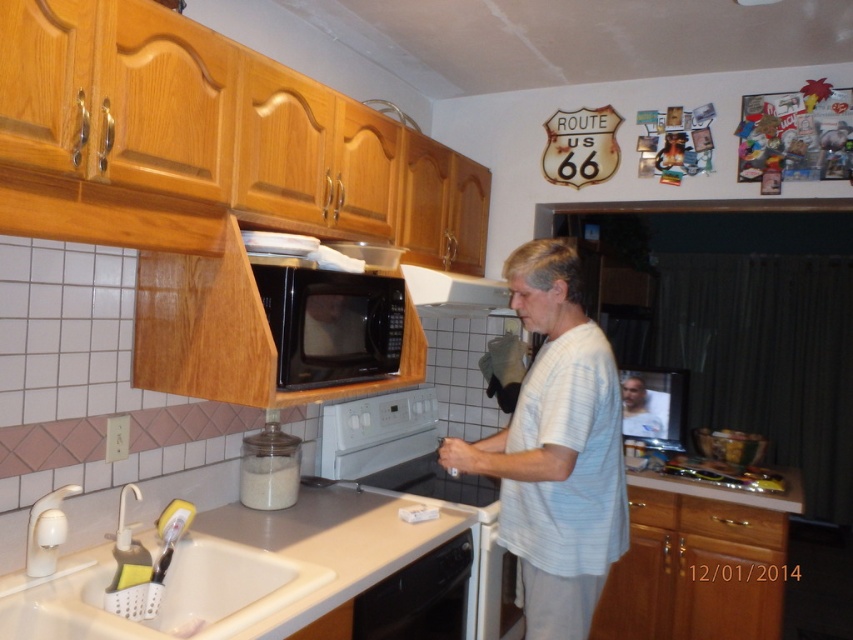
Question: Can you confirm if white striped shirt at center is positioned to the right of white plastic exhaust hood at upper center?

Choices:
 (A) yes
 (B) no

Answer: (A)

Question: Which object appears farthest from the camera in this image?

Choices:
 (A) beige laminate counter top at lower left
 (B) black matte microwave at upper center
 (C) white ceramic sink at lower left

Answer: (B)

Question: In this image, where is white striped shirt at center located relative to white matte jar at sink?

Choices:
 (A) left
 (B) right

Answer: (B)

Question: Which is nearer to the white matte shirt at center?

Choices:
 (A) beige laminate counter top at lower left
 (B) black matte microwave at upper center
 (C) white glossy oven at center
 (D) white striped shirt at center

Answer: (C)

Question: Considering the relative positions of white ceramic sink at lower left and black matte microwave at upper center in the image provided, where is white ceramic sink at lower left located with respect to black matte microwave at upper center?

Choices:
 (A) left
 (B) right

Answer: (A)

Question: Which of the following is the farthest from the observer?

Choices:
 (A) (314, 342)
 (B) (492, 291)

Answer: (B)